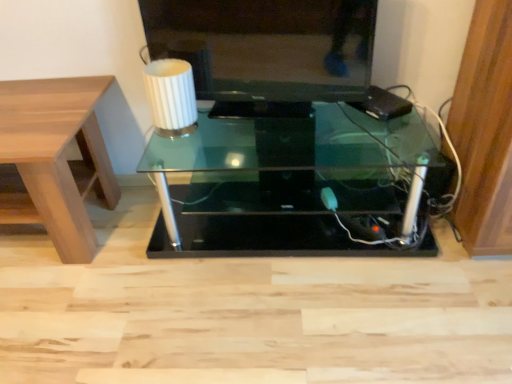
Question: In which direction should I rotate to look at transparent glass table at center, which is the 1th table in right-to-left order?

Choices:
 (A) right
 (B) left

Answer: (A)

Question: Can you confirm if white ribbed glass at upper center is bigger than transparent glass table at center, which is the 1th table in right-to-left order?

Choices:
 (A) yes
 (B) no

Answer: (B)

Question: Is white ribbed glass at upper center directly adjacent to transparent glass table at center, which is counted as the second table, starting from the left?

Choices:
 (A) yes
 (B) no

Answer: (B)

Question: Can you confirm if white ribbed glass at upper center is shorter than transparent glass table at center, which is counted as the second table, starting from the left?

Choices:
 (A) no
 (B) yes

Answer: (B)

Question: Can you confirm if white ribbed glass at upper center is positioned to the left of transparent glass table at center, which is the 1th table in right-to-left order?

Choices:
 (A) no
 (B) yes

Answer: (B)

Question: Does white ribbed glass at upper center contain transparent glass table at center, which is the 1th table in right-to-left order?

Choices:
 (A) no
 (B) yes

Answer: (A)

Question: Is the depth of white ribbed glass at upper center greater than that of transparent glass table at center, which is the 1th table in right-to-left order?

Choices:
 (A) no
 (B) yes

Answer: (B)

Question: Does matte black television at upper center come in front of light brown wood table at left, the 1th table viewed from the left?

Choices:
 (A) yes
 (B) no

Answer: (B)

Question: Is matte black television at upper center located outside light brown wood table at left, the 1th table viewed from the left?

Choices:
 (A) no
 (B) yes

Answer: (B)

Question: Is matte black television at upper center smaller than light brown wood table at left, the 1th table viewed from the left?

Choices:
 (A) no
 (B) yes

Answer: (B)

Question: From a real-world perspective, is matte black television at upper center below light brown wood table at left, the second table viewed from the right?

Choices:
 (A) yes
 (B) no

Answer: (B)

Question: Is matte black television at upper center at the right side of light brown wood table at left, the 1th table viewed from the left?

Choices:
 (A) no
 (B) yes

Answer: (B)

Question: Does matte black television at upper center have a larger size compared to light brown wood table at left, the second table viewed from the right?

Choices:
 (A) no
 (B) yes

Answer: (A)

Question: Does matte black television at upper center have a larger size compared to transparent glass table at center, which is counted as the second table, starting from the left?

Choices:
 (A) yes
 (B) no

Answer: (B)